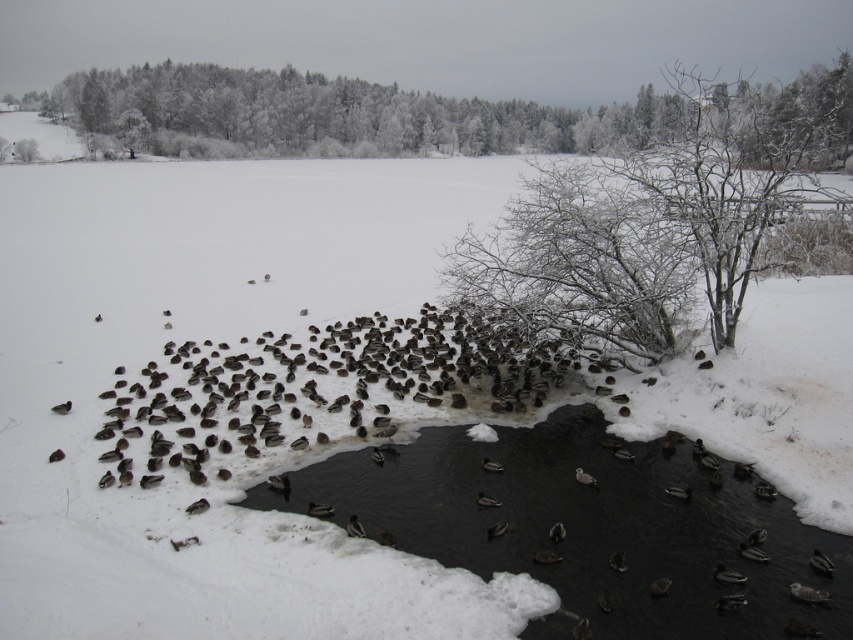
Between snow-covered branches at center and dark brown feathers at center, which one appears on the right side from the viewer's perspective?

Positioned to the right is snow-covered branches at center.

Who is lower down, snow-covered branches at center or dark brown feathers at center?

dark brown feathers at center is below.

In order to click on snow-covered branches at center in this screenshot , I will do `click(659, 218)`.

This screenshot has width=853, height=640. What are the coordinates of `snow-covered branches at center` in the screenshot? It's located at (659, 218).

Between black ice stream at lower center and snow-covered branches at center, which one is positioned higher?

Positioned higher is snow-covered branches at center.

What do you see at coordinates (589, 528) in the screenshot? I see `black ice stream at lower center` at bounding box center [589, 528].

Does point (569, 493) come in front of point (543, 218)?

That is True.

Find the location of a particular element. This screenshot has height=640, width=853. black ice stream at lower center is located at coordinates (589, 528).

Which is above, white frosty tree at upper center or dark brown feathers at center?

Positioned higher is white frosty tree at upper center.

Does white frosty tree at upper center have a greater height compared to dark brown feathers at center?

Yes, white frosty tree at upper center is taller than dark brown feathers at center.

What do you see at coordinates (332, 115) in the screenshot? I see `white frosty tree at upper center` at bounding box center [332, 115].

Find the location of `white frosty tree at upper center`. white frosty tree at upper center is located at coordinates (332, 115).